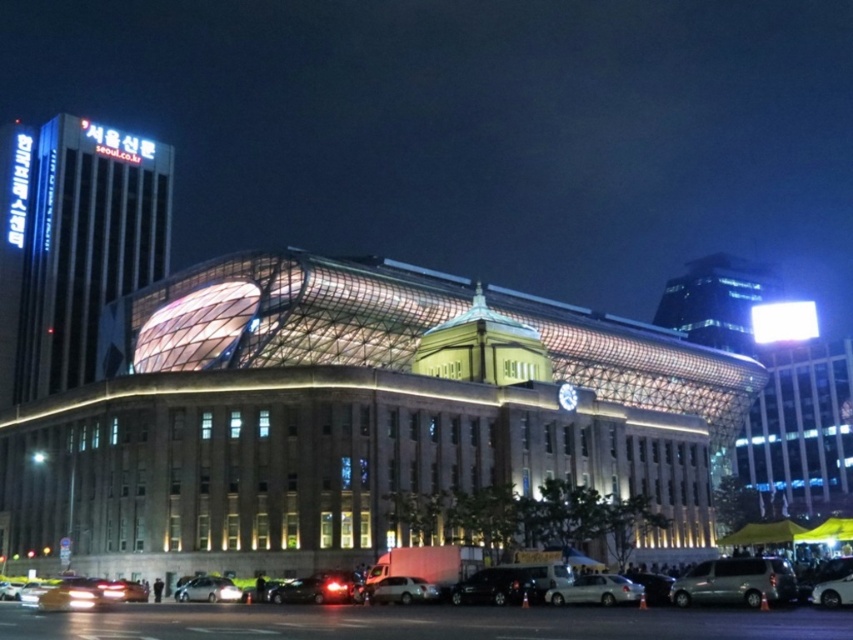
Is brick building at center behind shiny silver van at center?

Yes, it is.

Can you confirm if brick building at center is taller than shiny silver van at center?

Yes, brick building at center is taller than shiny silver van at center.

Which is in front, point (90, 440) or point (210, 589)?

Point (210, 589) is in front.

Where is `brick building at center`? The height and width of the screenshot is (640, 853). brick building at center is located at coordinates (350, 417).

Between point (265, 544) and point (714, 595), which one is positioned in front?

Positioned in front is point (714, 595).

Which is below, brick building at center or silver metallic van at lower right?

silver metallic van at lower right is lower down.

Between point (520, 408) and point (772, 593), which one is positioned in front?

Point (772, 593) is more forward.

I want to click on brick building at center, so click(x=350, y=417).

Does brick building at center appear under white matte car at lower center?

Actually, brick building at center is above white matte car at lower center.

From the picture: Is brick building at center shorter than white matte car at lower center?

Incorrect, brick building at center's height does not fall short of white matte car at lower center's.

Is point (115, 484) closer to camera compared to point (390, 584)?

No, it is behind (390, 584).

Where is `brick building at center`? Image resolution: width=853 pixels, height=640 pixels. brick building at center is located at coordinates (350, 417).